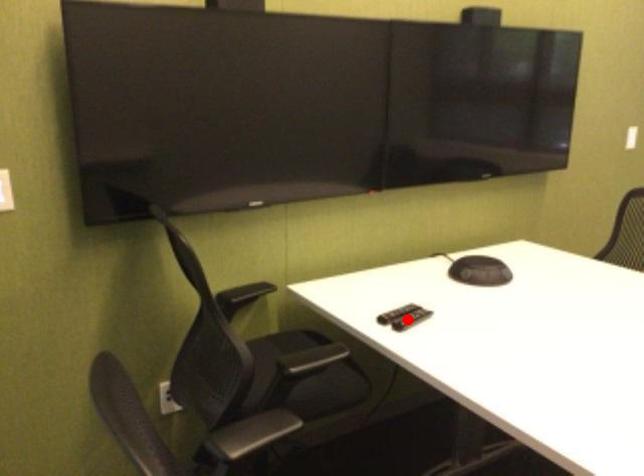
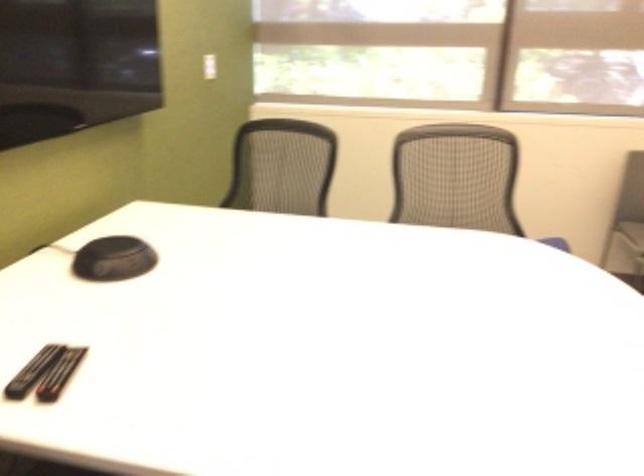
Locate, in the second image, the point that corresponds to the highlighted location in the first image.

(59, 374)